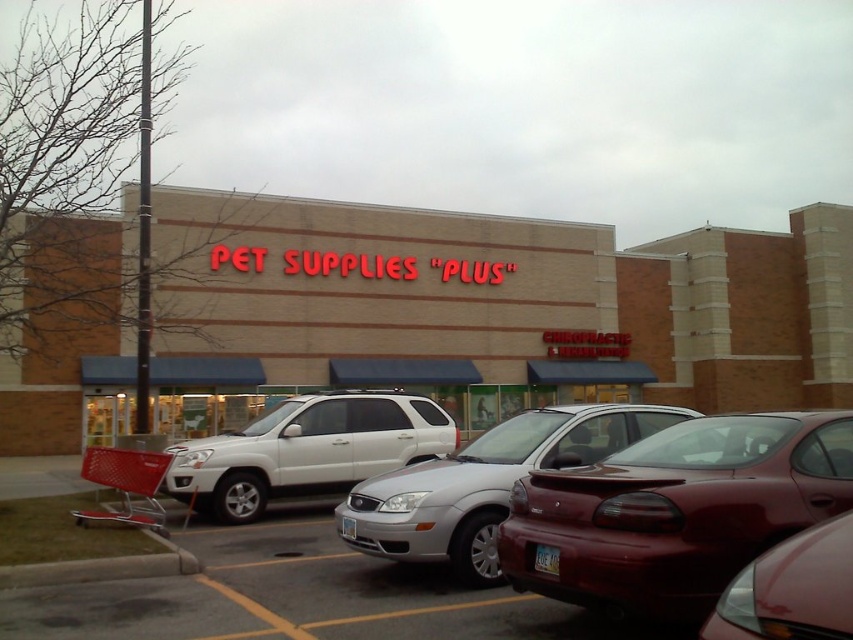
Question: In this image, where is white matte suv at center located relative to shiny red car at lower right?

Choices:
 (A) right
 (B) left

Answer: (B)

Question: Considering the real-world distances, which object is farthest from the white matte suv at center?

Choices:
 (A) red plastic shopping cart at lower left
 (B) beige brick building at center
 (C) shiny red sedan at center

Answer: (B)

Question: In this image, where is silver metallic sedan at center located relative to white matte suv at center?

Choices:
 (A) above
 (B) below

Answer: (A)

Question: Which object appears farthest from the camera in this image?

Choices:
 (A) shiny red car at lower right
 (B) silver metallic sedan at center

Answer: (B)

Question: Can you confirm if silver metallic sedan at center is positioned below red plastic shopping cart at lower left?

Choices:
 (A) yes
 (B) no

Answer: (B)

Question: Which of the following is the farthest from the observer?

Choices:
 (A) (746, 476)
 (B) (801, 593)

Answer: (A)